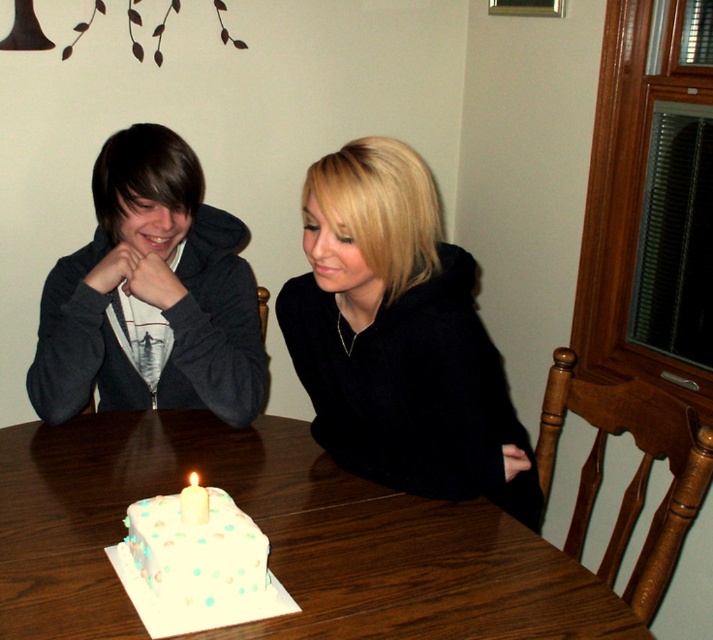
Question: Which point is farther to the camera?

Choices:
 (A) white frosted cake at center
 (B) matte black hoodie at left
 (C) black fuzzy sweater at center

Answer: (B)

Question: Estimate the real-world distances between objects in this image. Which object is closer to the white frosted cake at center?

Choices:
 (A) white wax candle at center
 (B) matte black hoodie at left
 (C) black fuzzy sweater at center

Answer: (A)

Question: Is white wooden table at center closer to camera compared to white frosted cake at center?

Choices:
 (A) no
 (B) yes

Answer: (B)

Question: In this image, where is white wooden table at center located relative to white frosted cake at center?

Choices:
 (A) above
 (B) below

Answer: (B)

Question: Is white wooden table at center smaller than matte black hoodie at left?

Choices:
 (A) no
 (B) yes

Answer: (A)

Question: Which object is closer to the camera taking this photo?

Choices:
 (A) black fuzzy sweater at center
 (B) matte black hoodie at left
 (C) white wax candle at center

Answer: (C)